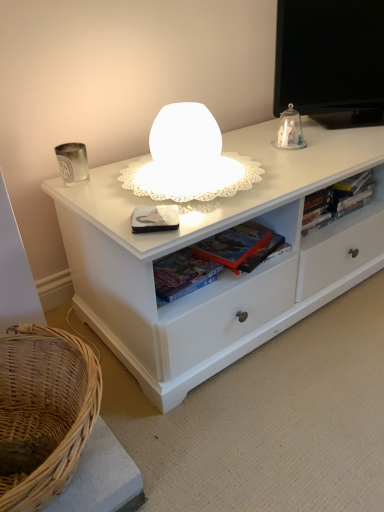
Question: Is woven natural basket at lower left far from hardcover book at right, the first book when ordered from right to left?

Choices:
 (A) yes
 (B) no

Answer: (B)

Question: From a real-world perspective, is woven natural basket at lower left physically above hardcover book at right, the first book when ordered from right to left?

Choices:
 (A) yes
 (B) no

Answer: (B)

Question: Does woven natural basket at lower left lie behind hardcover book at right, the first book when ordered from right to left?

Choices:
 (A) no
 (B) yes

Answer: (A)

Question: Is woven natural basket at lower left at the right side of hardcover book at right, the first book when ordered from right to left?

Choices:
 (A) no
 (B) yes

Answer: (A)

Question: Is woven natural basket at lower left outside of hardcover book at right, which appears as the third book when viewed from the left?

Choices:
 (A) yes
 (B) no

Answer: (A)

Question: Can you confirm if woven natural basket at lower left is taller than hardcover book at right, which appears as the third book when viewed from the left?

Choices:
 (A) yes
 (B) no

Answer: (A)

Question: Is hardcover book at right, which appears as the third book when viewed from the left, facing away from white matte paperback book at center?

Choices:
 (A) no
 (B) yes

Answer: (A)

Question: Are hardcover book at right, the first book when ordered from right to left, and white matte paperback book at center far apart?

Choices:
 (A) no
 (B) yes

Answer: (A)

Question: Would you say hardcover book at right, which appears as the third book when viewed from the left, is outside white matte paperback book at center?

Choices:
 (A) yes
 (B) no

Answer: (A)

Question: From a real-world perspective, is hardcover book at right, which appears as the third book when viewed from the left, over white matte paperback book at center?

Choices:
 (A) yes
 (B) no

Answer: (B)

Question: Is hardcover book at right, the first book when ordered from right to left, at the right side of white matte paperback book at center?

Choices:
 (A) no
 (B) yes

Answer: (B)

Question: Does hardcover book at right, which appears as the third book when viewed from the left, come behind white matte paperback book at center?

Choices:
 (A) no
 (B) yes

Answer: (B)

Question: From the image's perspective, does white matte paperback book at center appear higher than hardcover book at right, the first book when ordered from right to left?

Choices:
 (A) yes
 (B) no

Answer: (B)